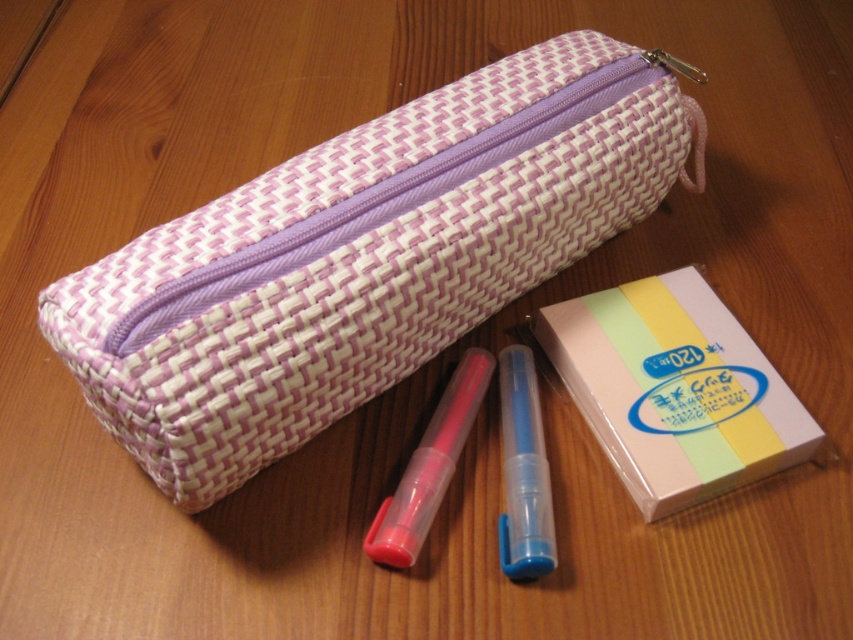
Question: Is woven fabric pencil case at center in front of pink matte pen at center?

Choices:
 (A) yes
 (B) no

Answer: (A)

Question: Which object appears closest to the camera in this image?

Choices:
 (A) pink matte pen at center
 (B) pastel striped paper at lower right

Answer: (A)

Question: Estimate the real-world distances between objects in this image. Which object is farther from the translucent plastic pen at center?

Choices:
 (A) pastel striped paper at lower right
 (B) woven fabric pencil case at center

Answer: (B)

Question: Does pastel striped paper at lower right have a smaller size compared to pink matte pen at center?

Choices:
 (A) no
 (B) yes

Answer: (A)

Question: Which point is closer to the camera?

Choices:
 (A) (575, 323)
 (B) (486, 291)

Answer: (B)

Question: Where is pastel striped paper at lower right located in relation to translucent plastic pen at center in the image?

Choices:
 (A) above
 (B) below

Answer: (A)